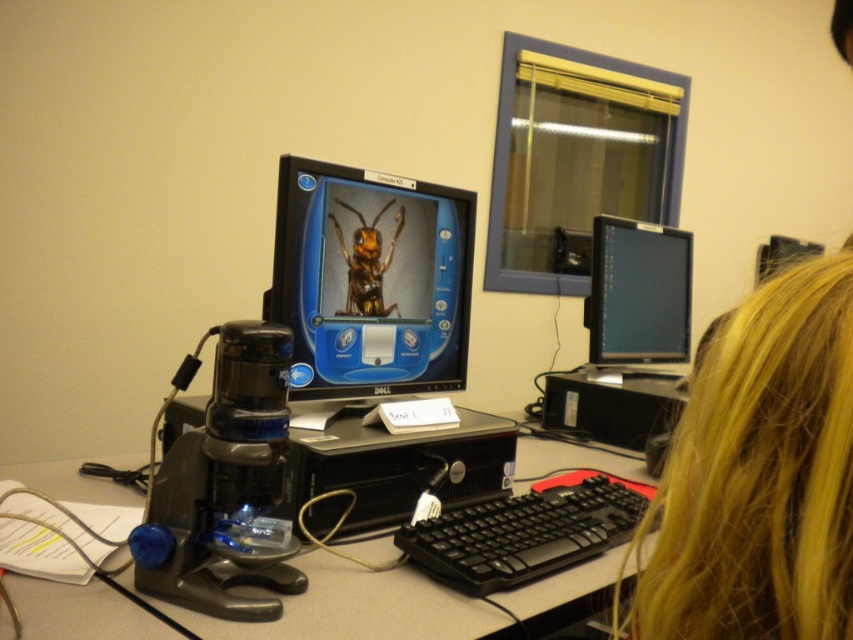
Is matte black monitor at center shorter than matte black monitor at upper right?

Yes, matte black monitor at center is shorter than matte black monitor at upper right.

Can you confirm if matte black monitor at center is positioned to the left of matte black monitor at upper right?

Correct, you'll find matte black monitor at center to the left of matte black monitor at upper right.

Describe the element at coordinates (370, 280) in the screenshot. I see `matte black monitor at center` at that location.

Where is `matte black monitor at center`? The width and height of the screenshot is (853, 640). matte black monitor at center is located at coordinates (370, 280).

Consider the image. Does black plastic computer desk at center have a greater width compared to metallic yellow insect at center?

Yes, black plastic computer desk at center is wider than metallic yellow insect at center.

Is point (625, 464) positioned before point (349, 262)?

No, it is not.

Where is `black plastic computer desk at center`? This screenshot has width=853, height=640. black plastic computer desk at center is located at coordinates (358, 609).

Between blonde hair at upper right and matte black monitor at upper right, which one is positioned lower?

blonde hair at upper right is lower down.

Does blonde hair at upper right appear on the left side of matte black monitor at upper right?

Correct, you'll find blonde hair at upper right to the left of matte black monitor at upper right.

Is point (666, 636) positioned behind point (666, 356)?

No.

Where is `blonde hair at upper right`? This screenshot has height=640, width=853. blonde hair at upper right is located at coordinates (759, 474).